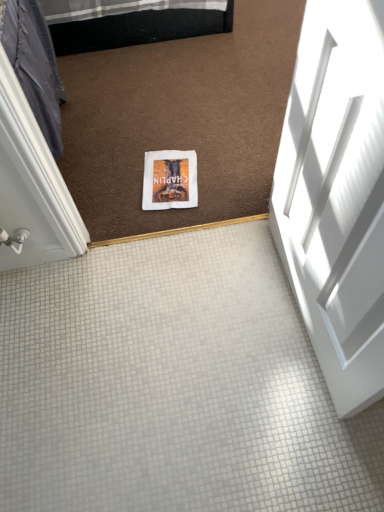
This screenshot has width=384, height=512. I want to click on vacant space that is to the left of white glossy door at right, so 200,325.